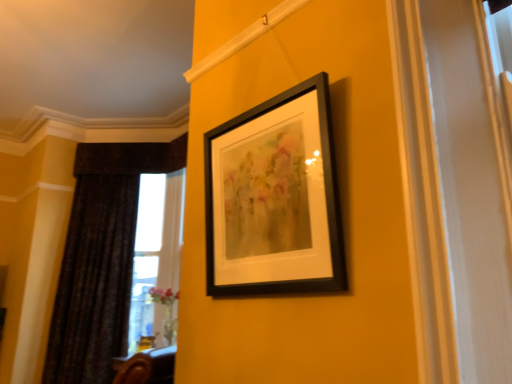
Question: Does black matte picture frame at upper center appear on the left side of dark velvet curtain at left?

Choices:
 (A) yes
 (B) no

Answer: (B)

Question: Can you confirm if black matte picture frame at upper center is wider than dark velvet curtain at left?

Choices:
 (A) no
 (B) yes

Answer: (A)

Question: Considering the relative sizes of black matte picture frame at upper center and dark velvet curtain at left in the image provided, is black matte picture frame at upper center bigger than dark velvet curtain at left?

Choices:
 (A) no
 (B) yes

Answer: (A)

Question: From the image's perspective, is black matte picture frame at upper center above dark velvet curtain at left?

Choices:
 (A) yes
 (B) no

Answer: (A)

Question: Considering the relative sizes of black matte picture frame at upper center and dark velvet curtain at left in the image provided, is black matte picture frame at upper center smaller than dark velvet curtain at left?

Choices:
 (A) no
 (B) yes

Answer: (B)

Question: Is black matte picture frame at upper center positioned behind dark velvet curtain at left?

Choices:
 (A) yes
 (B) no

Answer: (B)

Question: Is dark velvet curtain at left far away from black matte picture frame at upper center?

Choices:
 (A) yes
 (B) no

Answer: (A)

Question: Considering the relative sizes of dark velvet curtain at left and black matte picture frame at upper center in the image provided, is dark velvet curtain at left bigger than black matte picture frame at upper center?

Choices:
 (A) no
 (B) yes

Answer: (B)

Question: Is dark velvet curtain at left placed right next to black matte picture frame at upper center?

Choices:
 (A) no
 (B) yes

Answer: (A)

Question: From the image's perspective, is dark velvet curtain at left under black matte picture frame at upper center?

Choices:
 (A) yes
 (B) no

Answer: (A)

Question: Can you confirm if dark velvet curtain at left is positioned to the right of black matte picture frame at upper center?

Choices:
 (A) yes
 (B) no

Answer: (B)

Question: Considering the relative sizes of dark velvet curtain at left and black matte picture frame at upper center in the image provided, is dark velvet curtain at left smaller than black matte picture frame at upper center?

Choices:
 (A) yes
 (B) no

Answer: (B)

Question: From a real-world perspective, is black matte picture frame at upper center above or below dark velvet curtain at left?

Choices:
 (A) above
 (B) below

Answer: (A)